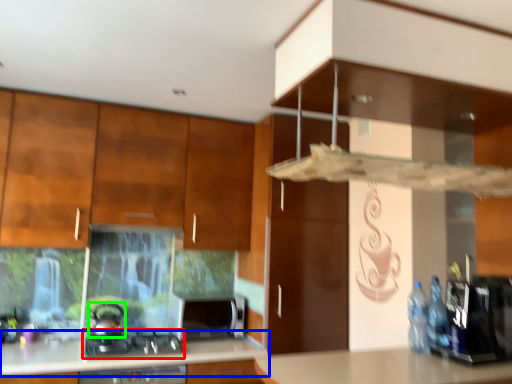
Question: Based on their relative distances, which object is farther from gas stove (highlighted by a red box)? Choose from countertop (highlighted by a blue box) and kitchen appliance (highlighted by a green box).

Choices:
 (A) countertop
 (B) kitchen appliance

Answer: (A)